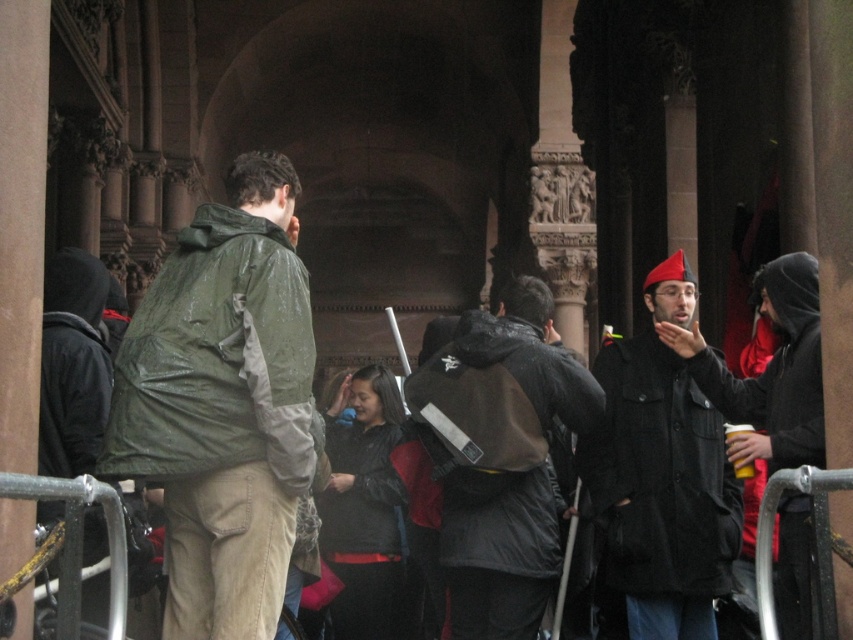
Between green matte jacket at left and dark gray matte jacket at center, which one appears on the right side from the viewer's perspective?

Positioned to the right is dark gray matte jacket at center.

Does green matte jacket at left have a greater width compared to dark gray matte jacket at center?

Incorrect, green matte jacket at left's width does not surpass dark gray matte jacket at center's.

Is point (222, 282) behind point (436, 454)?

No, it is not.

This screenshot has width=853, height=640. I want to click on green matte jacket at left, so click(x=218, y=360).

Does dark gray matte jacket at center appear on the right side of black woolen jacket at center-right?

No, dark gray matte jacket at center is not to the right of black woolen jacket at center-right.

Can you confirm if dark gray matte jacket at center is bigger than black woolen jacket at center-right?

Yes, dark gray matte jacket at center is bigger than black woolen jacket at center-right.

Does point (523, 518) lie behind point (650, 445)?

No.

Where is `dark gray matte jacket at center`? dark gray matte jacket at center is located at coordinates (498, 456).

Does dark gray matte jacket at center appear on the left side of black matte jacket at center?

No, dark gray matte jacket at center is not to the left of black matte jacket at center.

Does dark gray matte jacket at center appear over black matte jacket at center?

Correct, dark gray matte jacket at center is located above black matte jacket at center.

Identify the location of dark gray matte jacket at center. This screenshot has height=640, width=853. (498, 456).